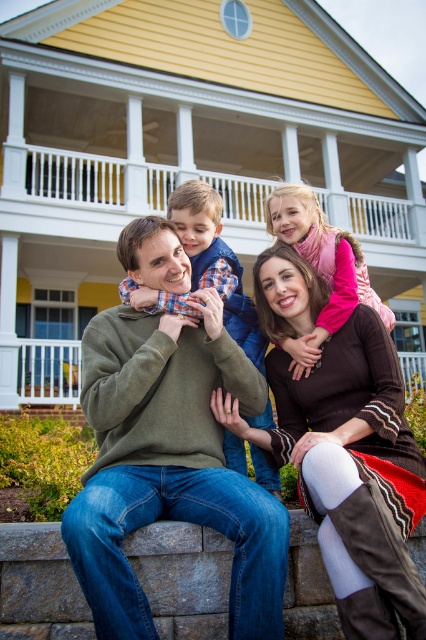
Question: Which object is positioned closest to the pink fleece jacket at center?

Choices:
 (A) white wooden railing at upper center
 (B) green sweater at center
 (C) plaid shirt at center
 (D) stone ledge at lower center

Answer: (C)

Question: Is green sweater at center to the left of white wooden railing at upper center from the viewer's perspective?

Choices:
 (A) no
 (B) yes

Answer: (B)

Question: Is plaid shirt at center further to the viewer compared to pink fleece jacket at center?

Choices:
 (A) yes
 (B) no

Answer: (A)

Question: Estimate the real-world distances between objects in this image. Which object is farther from the green sweater at center?

Choices:
 (A) stone ledge at lower center
 (B) white wooden railing at upper center
 (C) plaid shirt at center

Answer: (B)

Question: Estimate the real-world distances between objects in this image. Which object is closer to the stone ledge at lower center?

Choices:
 (A) plaid shirt at center
 (B) green sweater at center
 (C) white wooden railing at upper center
 (D) pink fleece jacket at center

Answer: (B)

Question: Does stone ledge at lower center appear on the left side of white wooden railing at upper center?

Choices:
 (A) yes
 (B) no

Answer: (A)